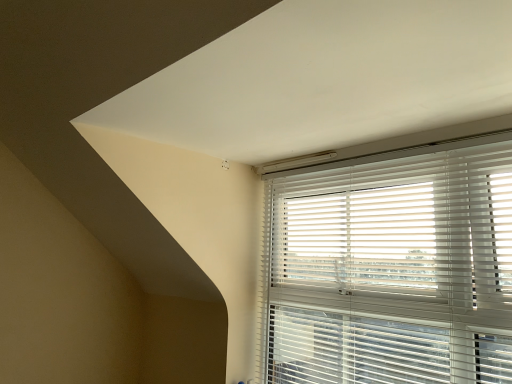
What do you see at coordinates (392, 267) in the screenshot?
I see `white plastic blinds at upper right` at bounding box center [392, 267].

This screenshot has height=384, width=512. I want to click on white plastic blinds at upper right, so click(392, 267).

Locate an element on the screen. Image resolution: width=512 pixels, height=384 pixels. white plastic blinds at upper right is located at coordinates (392, 267).